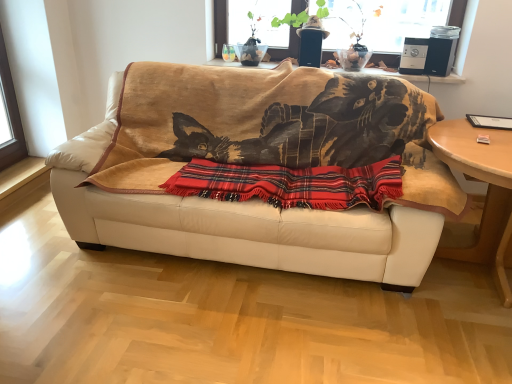
Question: Can you confirm if leather couch at center is bigger than wooden round table at right?

Choices:
 (A) no
 (B) yes

Answer: (B)

Question: Can you confirm if leather couch at center is taller than wooden round table at right?

Choices:
 (A) no
 (B) yes

Answer: (B)

Question: From a real-world perspective, does leather couch at center sit lower than wooden round table at right?

Choices:
 (A) yes
 (B) no

Answer: (B)

Question: Is leather couch at center not within wooden round table at right?

Choices:
 (A) yes
 (B) no

Answer: (A)

Question: Does leather couch at center appear on the left side of wooden round table at right?

Choices:
 (A) yes
 (B) no

Answer: (A)

Question: From a real-world perspective, is leather couch at center above or below wooden round table at right?

Choices:
 (A) below
 (B) above

Answer: (B)

Question: Is point (140, 94) closer or farther from the camera than point (484, 205)?

Choices:
 (A) farther
 (B) closer

Answer: (A)

Question: Considering the positions of leather couch at center and wooden round table at right in the image, is leather couch at center bigger or smaller than wooden round table at right?

Choices:
 (A) big
 (B) small

Answer: (A)

Question: Considering the positions of leather couch at center and wooden round table at right in the image, is leather couch at center taller or shorter than wooden round table at right?

Choices:
 (A) tall
 (B) short

Answer: (A)

Question: From their relative heights in the image, would you say wooden round table at right is taller or shorter than smooth glass window sill at upper center?

Choices:
 (A) short
 (B) tall

Answer: (B)

Question: From the image's perspective, is wooden round table at right above or below smooth glass window sill at upper center?

Choices:
 (A) above
 (B) below

Answer: (B)

Question: Does point (501, 294) appear closer or farther from the camera than point (245, 66)?

Choices:
 (A) closer
 (B) farther

Answer: (A)

Question: In the image, is wooden round table at right positioned in front of or behind smooth glass window sill at upper center?

Choices:
 (A) front
 (B) behind

Answer: (A)

Question: Would you say wooden round table at right is to the left or to the right of red plaid blanket at center in the picture?

Choices:
 (A) left
 (B) right

Answer: (B)

Question: Is point (501, 284) closer or farther from the camera than point (356, 170)?

Choices:
 (A) closer
 (B) farther

Answer: (A)